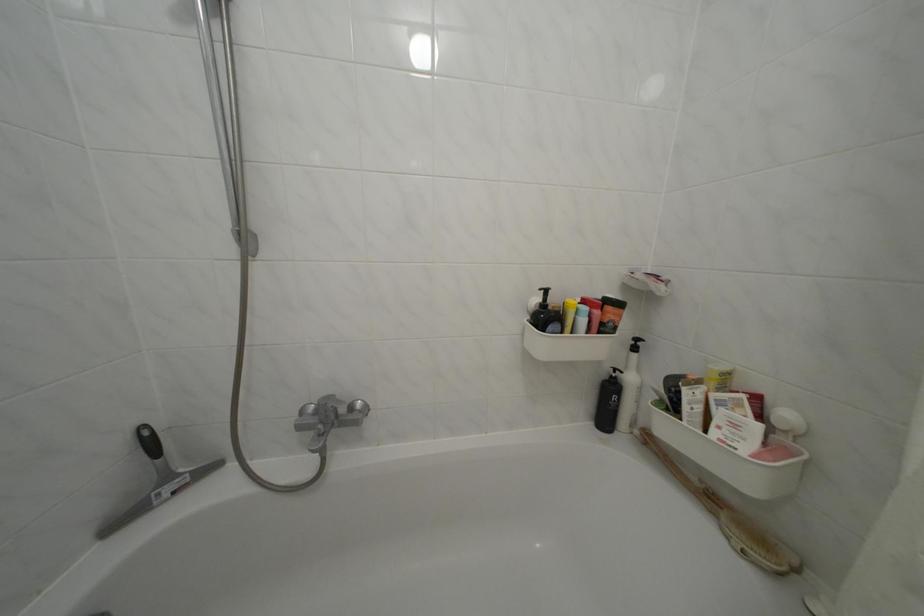
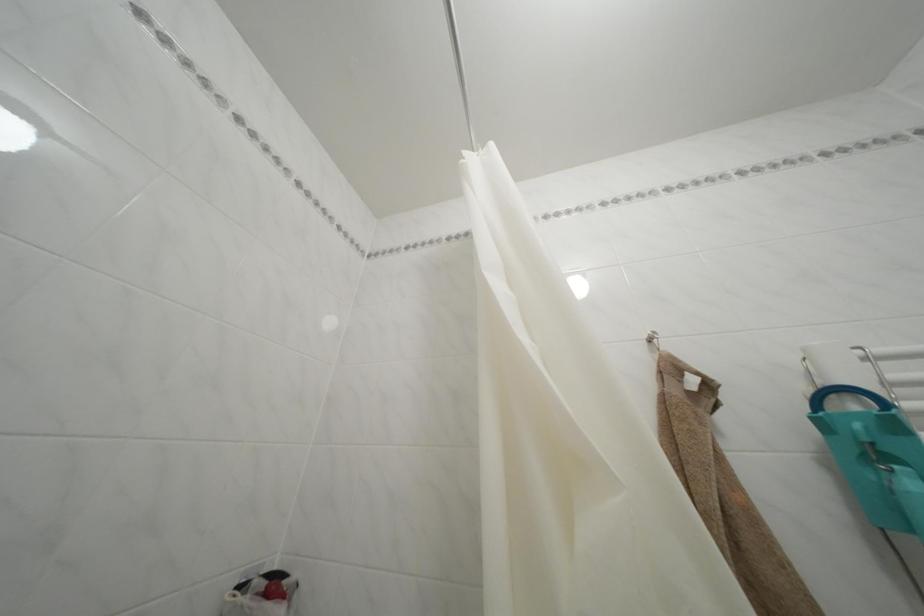
First-person continuous shooting, in which direction is the camera rotating?

The camera's rotation is toward right-up.